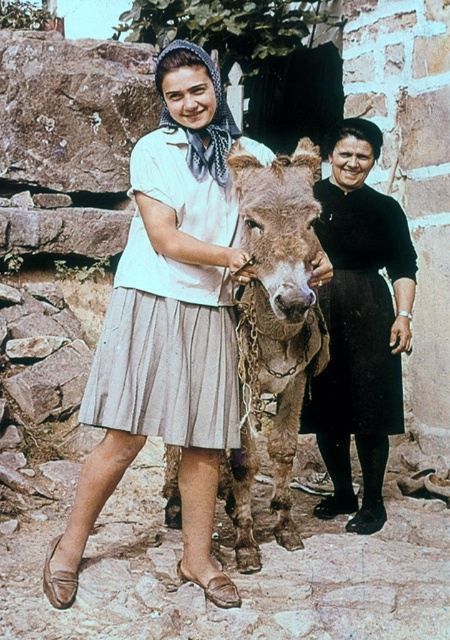
You are a photographer setting up a shoot in this scene. You want to ensure that the black velvet skirt at right and the brown rough textured mule at center are both visible in the frame. Based on their positions, which object is covering part of the other?

The black velvet skirt at right is positioned over the brown rough textured mule at center, so it is covering part of it.

You are a photographer trying to capture a photo of both the light beige pleated skirt at center and the brown rough textured mule at center. Based on their positions, which object should you adjust your camera to focus on first if you want to include both in the frame?

The light beige pleated skirt at center is to the left of brown rough textured mule at center, so you should focus on the light beige pleated skirt at center first to ensure both are in the frame.